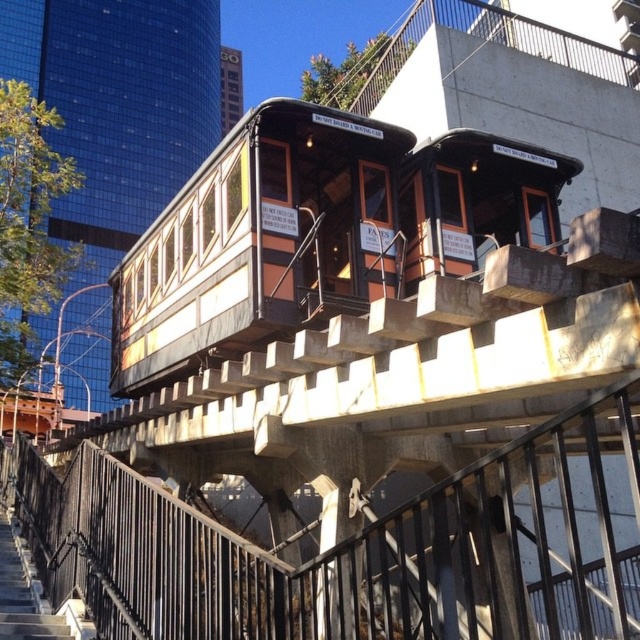
Which is more to the right, wooden passenger train at center or wooden stairs at lower left?

wooden passenger train at center

Is wooden passenger train at center above wooden stairs at lower left?

Yes, wooden passenger train at center is above wooden stairs at lower left.

Who is more distant from viewer, (552, 205) or (32, 579)?

The point (552, 205) is behind.

I want to click on wooden passenger train at center, so click(x=316, y=234).